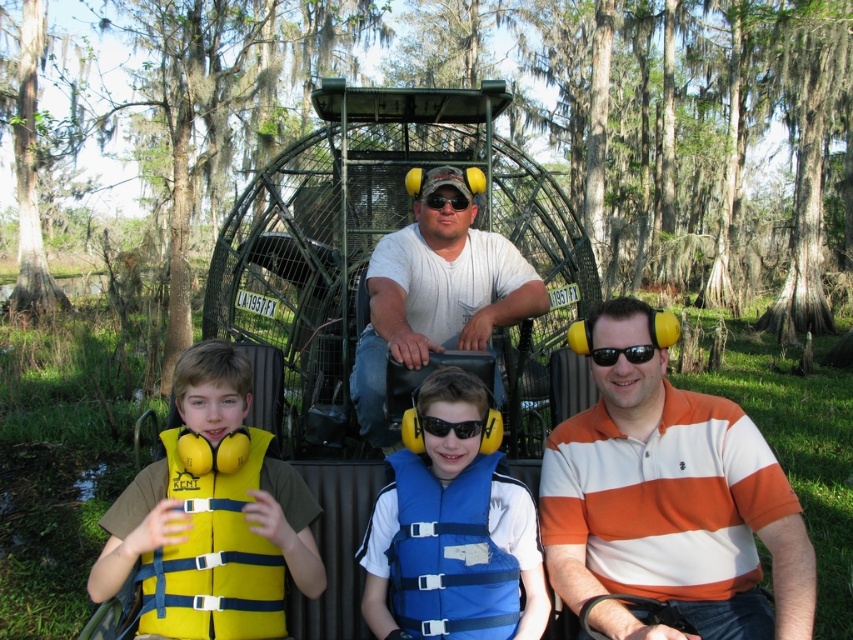
You are a safety inspector checking the airboat. You notice the blue life vest at center and the black plastic sunglasses at center. According to safety regulations, life vests must be easily accessible and not obstructed by other items. Is the current arrangement compliant?

The blue life vest at center is located below black plastic sunglasses at center, which means it might be obstructed by the sunglasses. This arrangement does not comply with safety regulations as the life vest should be easily accessible without obstruction.

Based on the photo, you are a safety inspector checking the airboat for proper safety equipment. The blue life vest at center is located at coordinates 0.858, 0.531. Is this position within the designated safety zone for life vests on the airboat?

The blue life vest at center is located at point (451, 548), which is within the designated safety zone for life vests on the airboat.

Consider the image. You are a safety inspector checking the airboat passengers. You notice the orange striped polo shirt at center and the yellow fabric life jacket at left. According to safety regulations, life jackets must be worn on the left side of all passengers. Is the current arrangement compliant?

The orange striped polo shirt at center is positioned on the right side of yellow fabric life jacket at left. Since the yellow fabric life jacket at left is on the left side, it complies with the safety regulation requiring life jackets to be worn on the left side of all passengers.